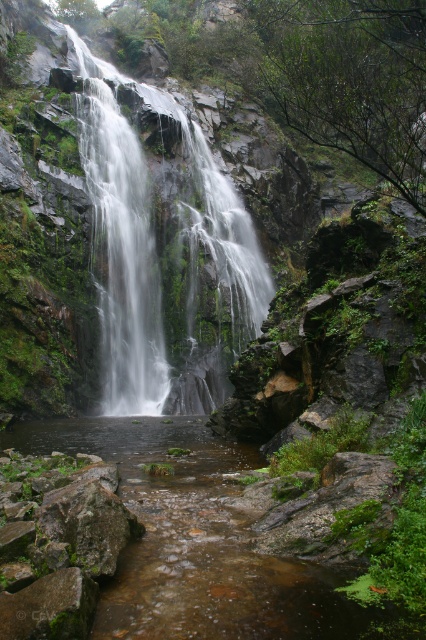
Based on the photo, you are a hiker who wants to cross the clear water at center. There is a clear water stream at center nearby. Which direction should you go to avoid the stream?

The clear water stream at center is positioned on the right side of clear water at center, so to avoid the stream, you should go to the left side of clear water at center.

You are a hiker who wants to cross the stream to reach the other side. The clear water stream at center is located at coordinates point 0.852, 0.474. Is the stream at that point safe to cross?

The clear water stream at center is located at point (201, 545). Since the stream is clear, it indicates that the water flow might be calmer, making it safer to cross compared to areas with more turbulent or murky water. However, hikers should still exercise caution due to the rocky and uneven terrain around the stream.

You are standing at the edge of the waterfall and want to cross to the other side. There is a point marked at coordinates (201, 545). Based on the scene description, what is the safest path to cross the water?

The safest path to cross the water would be at the point (201, 545), which corresponds to the clear water stream at center. This area is calmer and has clearer water, making it safer for crossing compared to the turbulent waterfall areas.